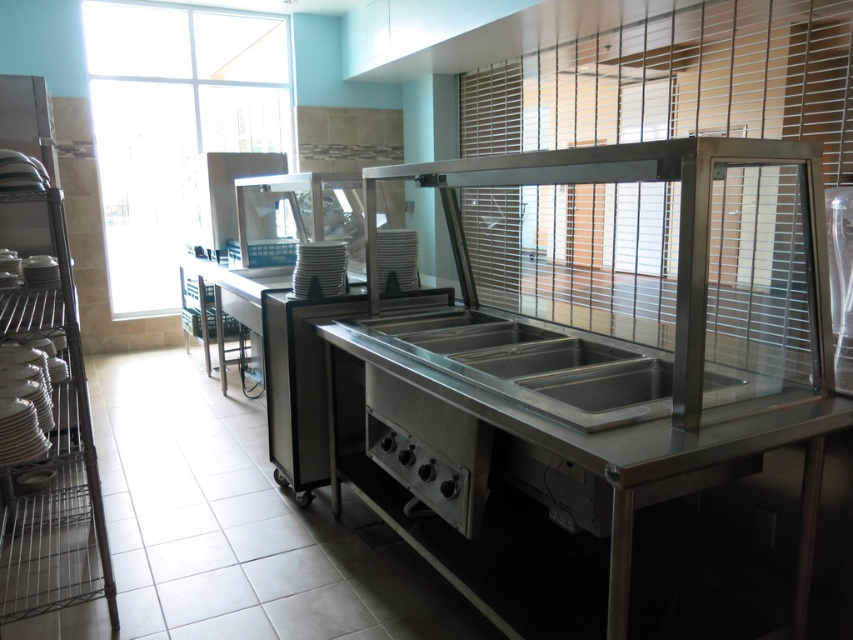
You are a new employee in the kitchen and need to wash dishes. The kitchen has a stainless steel buffet at center and a stainless steel sink at center. Which one should you go to first if you want to wash dishes?

You should go to the stainless steel sink at center first because the stainless steel buffet at center is positioned on the right side of it, meaning the sink is to the left and closer for dishwashing tasks.

You are a new employee in a cafeteria and need to place a large serving tray. The stainless steel buffet at center and the stainless steel sink at center are both available. Which one has enough space to accommodate the tray?

The stainless steel buffet at center is bigger than the stainless steel sink at center, so it has enough space to accommodate the tray.